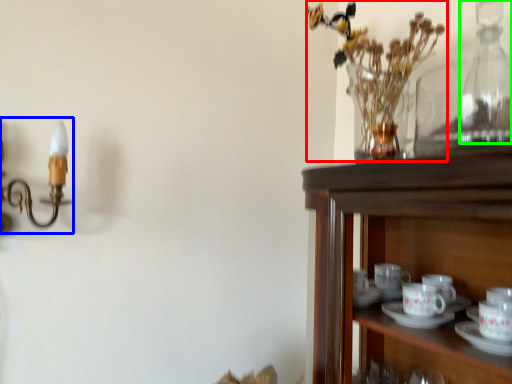
Question: Which is farther away from floral arrangement (highlighted by a red box)? candle holder (highlighted by a blue box) or bottle (highlighted by a green box)?

Choices:
 (A) candle holder
 (B) bottle

Answer: (A)